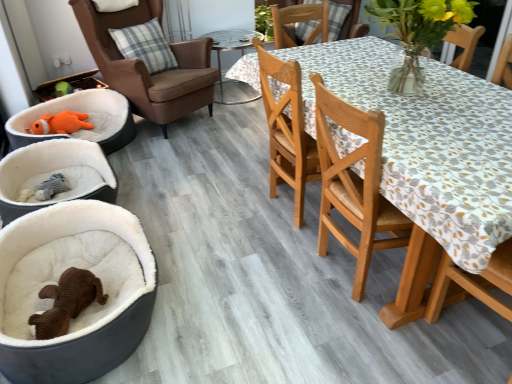
Question: Can you confirm if wooden table at right is positioned to the left of white plush dog bed at lower left?

Choices:
 (A) yes
 (B) no

Answer: (B)

Question: Is wooden table at right facing towards white plush dog bed at lower left?

Choices:
 (A) yes
 (B) no

Answer: (B)

Question: Is wooden table at right thinner than white plush dog bed at lower left?

Choices:
 (A) no
 (B) yes

Answer: (B)

Question: From a real-world perspective, does wooden table at right stand above white plush dog bed at lower left?

Choices:
 (A) no
 (B) yes

Answer: (B)

Question: Does wooden table at right have a greater height compared to white plush dog bed at lower left?

Choices:
 (A) yes
 (B) no

Answer: (A)

Question: Is wooden table at right at the right side of white plush dog bed at lower left?

Choices:
 (A) no
 (B) yes

Answer: (B)

Question: Can you confirm if plaid fabric pillow at upper left is wider than wooden chair at center, the 2th chair viewed from the left?

Choices:
 (A) no
 (B) yes

Answer: (A)

Question: From the image's perspective, is plaid fabric pillow at upper left beneath wooden chair at center, which is counted as the 2th chair, starting from the back?

Choices:
 (A) no
 (B) yes

Answer: (A)

Question: Is plaid fabric pillow at upper left to the left of wooden chair at center, which is counted as the 2th chair, starting from the back, from the viewer's perspective?

Choices:
 (A) no
 (B) yes

Answer: (B)

Question: Does plaid fabric pillow at upper left have a smaller size compared to wooden chair at center, arranged as the 1th chair when viewed from the front?

Choices:
 (A) no
 (B) yes

Answer: (B)

Question: From a real-world perspective, is plaid fabric pillow at upper left physically below wooden chair at center, the 2th chair viewed from the left?

Choices:
 (A) no
 (B) yes

Answer: (A)

Question: Does plaid fabric pillow at upper left appear on the right side of wooden chair at center, the 2th chair viewed from the left?

Choices:
 (A) no
 (B) yes

Answer: (A)

Question: Considering the relative positions of transparent glass table at center and white plush pet bed at left in the image provided, is transparent glass table at center to the right of white plush pet bed at left from the viewer's perspective?

Choices:
 (A) no
 (B) yes

Answer: (B)